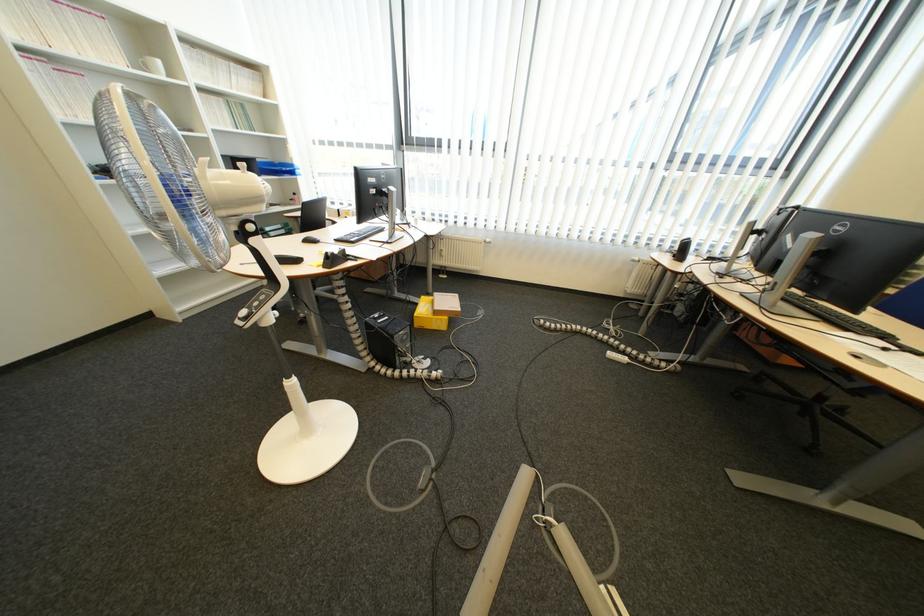
Where is `radiator control knob`? This screenshot has width=924, height=616. radiator control knob is located at coordinates (458, 252).